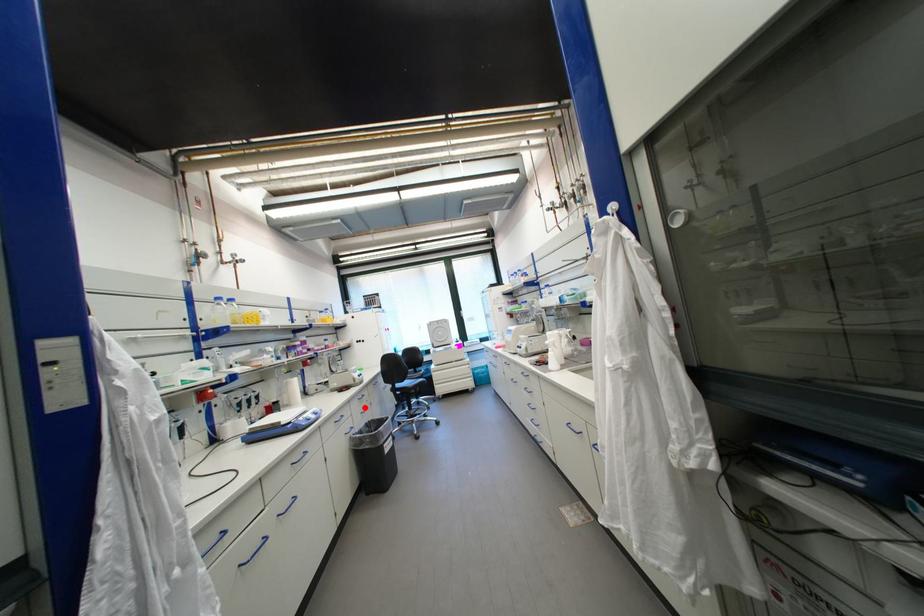
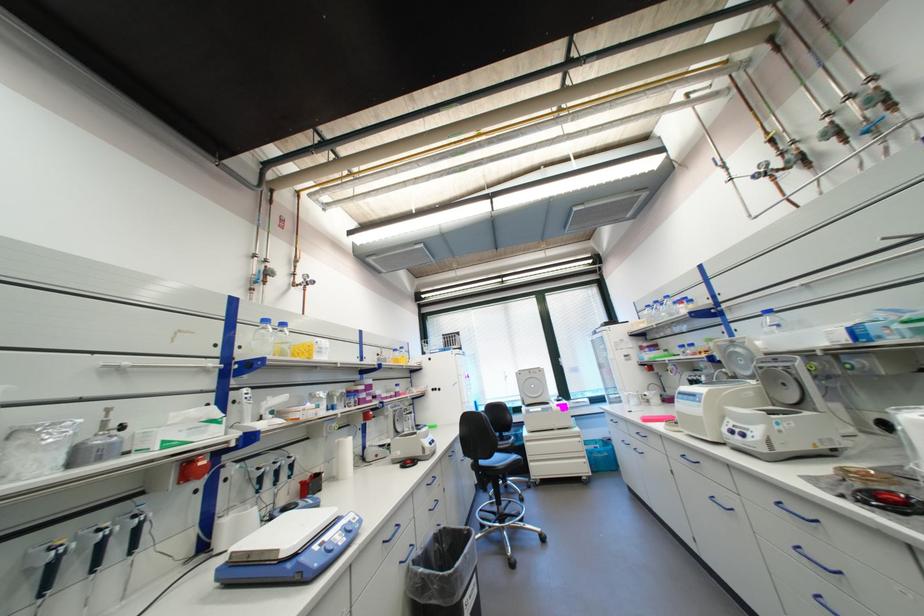
Where in the second image is the point corresponding to the highlighted location from the first image?

(431, 501)